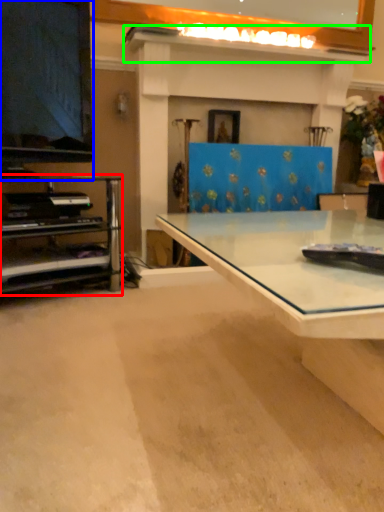
Question: Which is nearer to the shelf (highlighted by a red box)? television (highlighted by a blue box) or mantle (highlighted by a green box).

Choices:
 (A) television
 (B) mantle

Answer: (A)